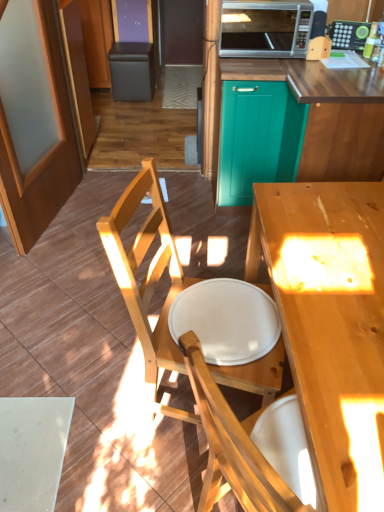
Question: Can you confirm if teal wood cabinet at upper center is positioned to the right of light wood desk at center?

Choices:
 (A) yes
 (B) no

Answer: (A)

Question: Considering the relative positions of teal wood cabinet at upper center and light wood desk at center in the image provided, is teal wood cabinet at upper center to the left of light wood desk at center from the viewer's perspective?

Choices:
 (A) yes
 (B) no

Answer: (B)

Question: Considering the relative sizes of teal wood cabinet at upper center and light wood desk at center in the image provided, is teal wood cabinet at upper center thinner than light wood desk at center?

Choices:
 (A) yes
 (B) no

Answer: (B)

Question: Can you confirm if teal wood cabinet at upper center is smaller than light wood desk at center?

Choices:
 (A) yes
 (B) no

Answer: (B)

Question: Is teal wood cabinet at upper center bigger than light wood desk at center?

Choices:
 (A) yes
 (B) no

Answer: (A)

Question: Is white matte plate at center to the left or to the right of teal glossy cabinet at center, which appears as the first screen door when viewed from the right, in the image?

Choices:
 (A) left
 (B) right

Answer: (A)

Question: From the image's perspective, is white matte plate at center positioned above or below teal glossy cabinet at center, which appears as the first screen door when viewed from the right?

Choices:
 (A) below
 (B) above

Answer: (A)

Question: Is point (243, 298) positioned closer to the camera than point (258, 83)?

Choices:
 (A) closer
 (B) farther

Answer: (A)

Question: Which is correct: white matte plate at center is inside teal glossy cabinet at center, which appears as the first screen door when viewed from the right, or outside of it?

Choices:
 (A) inside
 (B) outside

Answer: (B)

Question: In terms of width, does teal glossy cabinet at center, the second screen door viewed from the left, look wider or thinner when compared to matte black bar stool at upper left?

Choices:
 (A) wide
 (B) thin

Answer: (A)

Question: Visually, is teal glossy cabinet at center, which appears as the first screen door when viewed from the right, positioned to the left or to the right of matte black bar stool at upper left?

Choices:
 (A) right
 (B) left

Answer: (A)

Question: Would you say teal glossy cabinet at center, which appears as the first screen door when viewed from the right, is inside or outside matte black bar stool at upper left?

Choices:
 (A) outside
 (B) inside

Answer: (A)

Question: From the image's perspective, is teal glossy cabinet at center, which appears as the first screen door when viewed from the right, positioned above or below matte black bar stool at upper left?

Choices:
 (A) below
 (B) above

Answer: (A)

Question: Is light wood chair at center bigger or smaller than teal glossy cabinet at center, the second screen door viewed from the left?

Choices:
 (A) big
 (B) small

Answer: (A)

Question: From the image's perspective, relative to teal glossy cabinet at center, which appears as the first screen door when viewed from the right, is light wood chair at center above or below?

Choices:
 (A) above
 (B) below

Answer: (B)